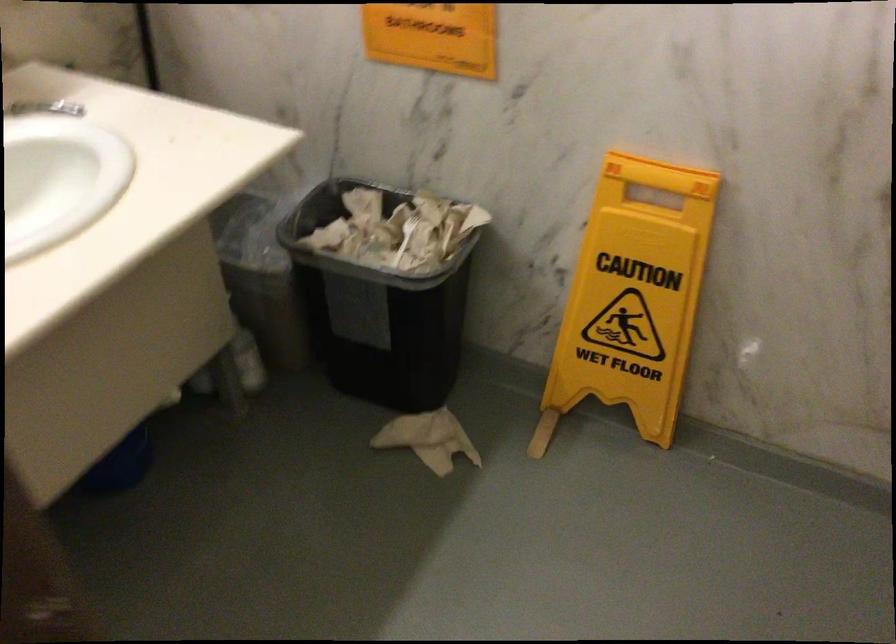
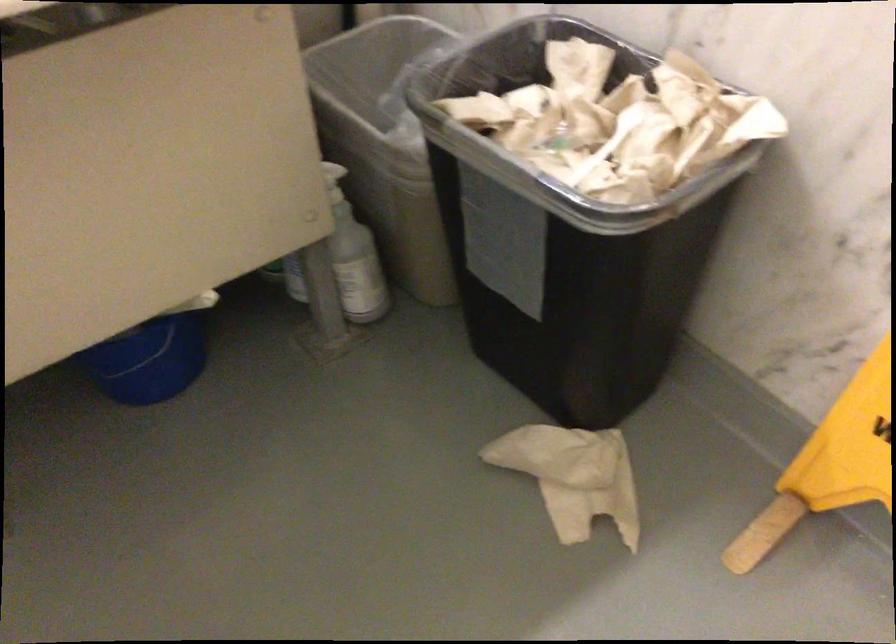
In the second image, find the point that corresponds to [127,458] in the first image.

(149, 361)